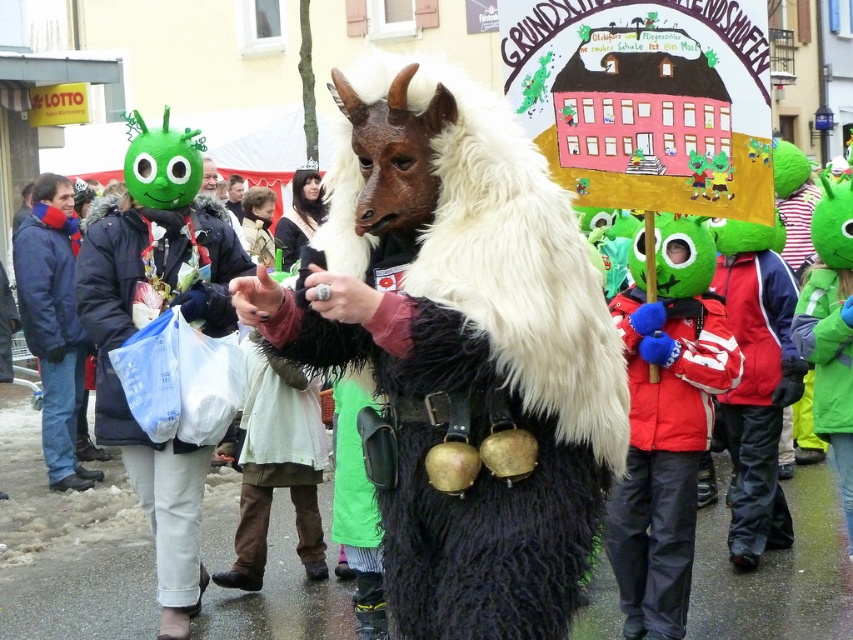
Can you confirm if furry black and white goat at center is positioned below smooth brown leather jacket at center?

Yes, furry black and white goat at center is below smooth brown leather jacket at center.

Which is below, furry black and white goat at center or smooth brown leather jacket at center?

furry black and white goat at center

Where is `furry black and white goat at center`? Image resolution: width=853 pixels, height=640 pixels. furry black and white goat at center is located at coordinates (460, 349).

Can you confirm if furry black and white goat at center is positioned to the left of green fabric bag at lower left?

No, furry black and white goat at center is not to the left of green fabric bag at lower left.

Does furry black and white goat at center appear over green fabric bag at lower left?

Correct, furry black and white goat at center is located above green fabric bag at lower left.

Is point (357, 156) closer to viewer compared to point (201, 224)?

Yes, it is.

I want to click on furry black and white goat at center, so click(460, 349).

Consider the image. Who is higher up, furry black and white goat at center or matte green mask at center?

furry black and white goat at center

Can you confirm if furry black and white goat at center is positioned below matte green mask at center?

No.

Measure the distance between furry black and white goat at center and camera.

furry black and white goat at center and camera are 4.13 meters apart.

The height and width of the screenshot is (640, 853). I want to click on furry black and white goat at center, so click(460, 349).